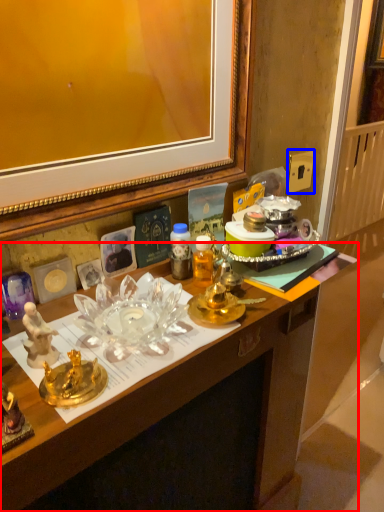
Question: Which object appears farthest to the camera in this image, desk (highlighted by a red box) or power outlet (highlighted by a blue box)?

Choices:
 (A) desk
 (B) power outlet

Answer: (B)